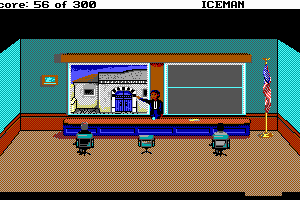
Image resolution: width=300 pixels, height=200 pixels. Identify the location of painting. (49, 81).